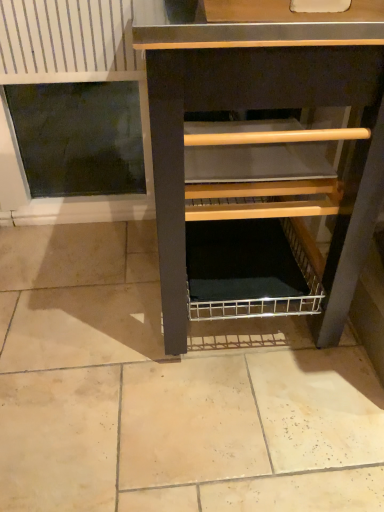
Measure the distance between metallic silver shelf at center and camera.

→ 25.04 inches.

The width and height of the screenshot is (384, 512). What do you see at coordinates (262, 132) in the screenshot?
I see `metallic silver shelf at center` at bounding box center [262, 132].

The image size is (384, 512). What are the coordinates of `metallic silver shelf at center` in the screenshot? It's located at (262, 132).

Locate an element on the screen. The image size is (384, 512). metallic silver shelf at center is located at coordinates (262, 132).